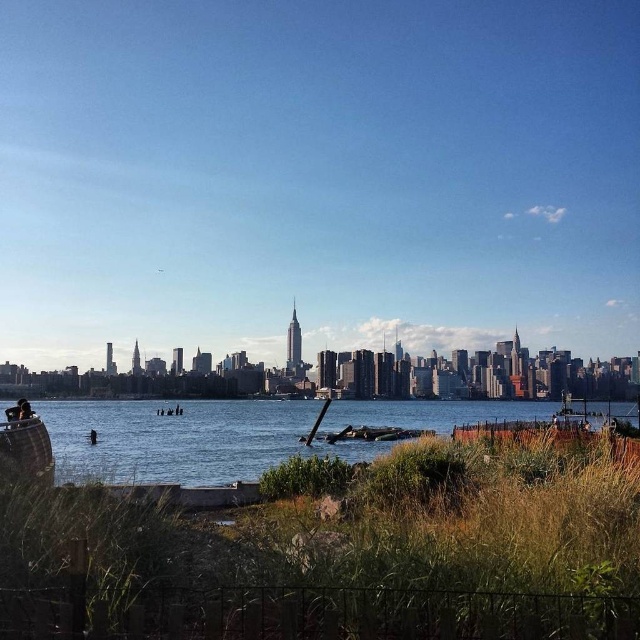
You are standing at the grassy area with overgrown vegetation and want to reach the wooden boat at lower left. Which direction should you walk to get there without crossing the clear blue water at lower center?

You should walk towards the lower left direction, as the clear blue water at lower center is in front of the wooden boat at lower left, meaning the boat is behind the water from your current position. However, since the water is between you and the boat, you might need to find a path around it rather than crossing directly.

You are standing at the grassy area near the metal fence and want to reach the wooden boat at lower left. Which direction should you walk to get there from the clear blue water at lower center?

You should walk to the left from the clear blue water at lower center because the wooden boat at lower left is positioned to the left of it.